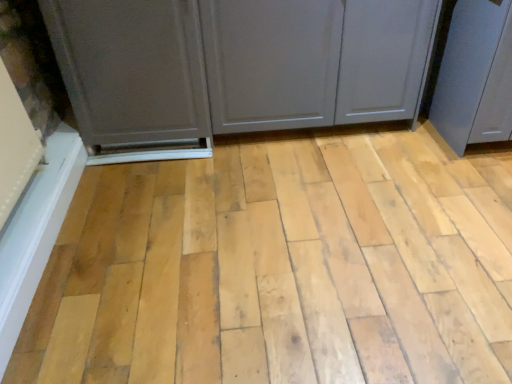
Find the location of a particular element. The height and width of the screenshot is (384, 512). free space in front of matte gray cupboard at center is located at coordinates [x=324, y=195].